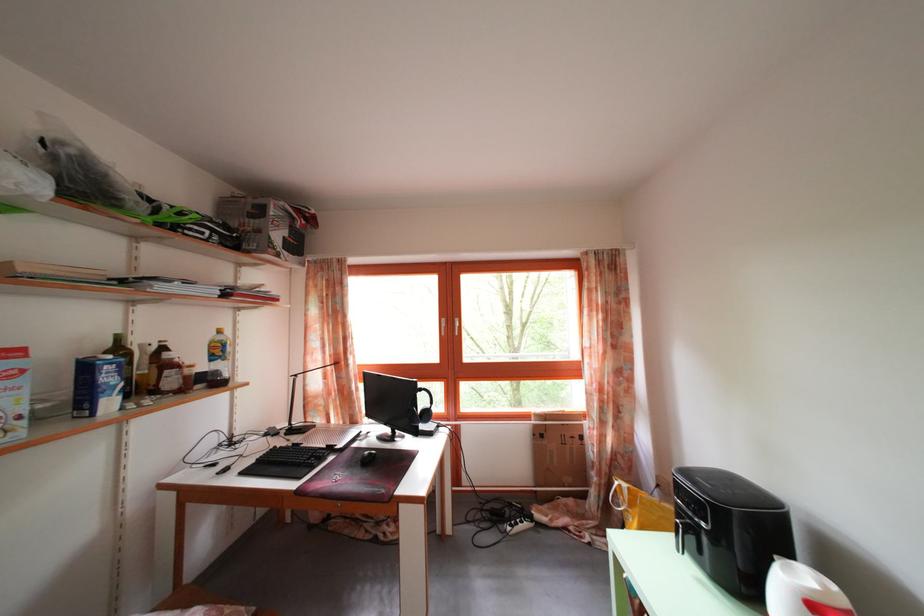
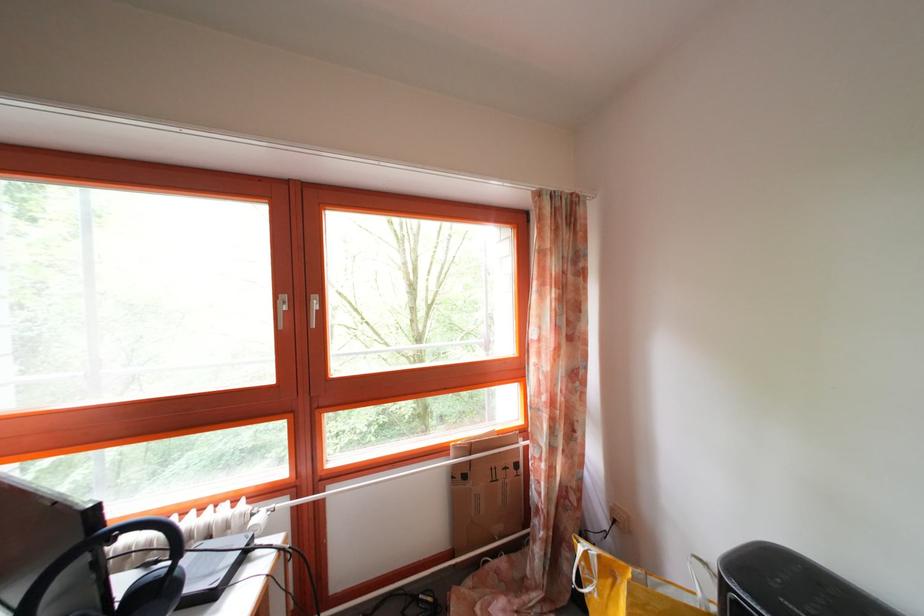
The point at [550,443] is marked in the first image. Where is the corresponding point in the second image?

(472, 484)